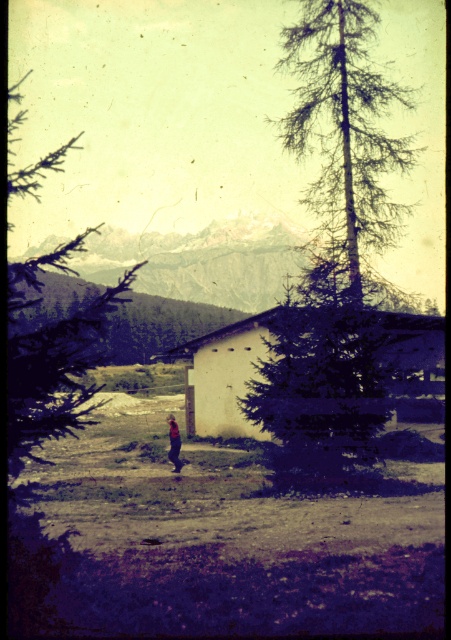
Question: Observing the image, what is the correct spatial positioning of white matte hut at center in reference to dark blue jeans at center?

Choices:
 (A) above
 (B) below

Answer: (A)

Question: Which object is farther from the camera taking this photo?

Choices:
 (A) green leafy tree at left
 (B) needle-like bark pine at center
 (C) white matte hut at center

Answer: (C)

Question: Among these points, which one is farthest from the camera?

Choices:
 (A) (174, 468)
 (B) (359, 349)

Answer: (A)

Question: Is green leafy tree at left thinner than dark blue jeans at center?

Choices:
 (A) yes
 (B) no

Answer: (B)

Question: Which point is farther to the camera?

Choices:
 (A) tap(27, 392)
 (B) tap(339, 332)

Answer: (B)

Question: Is the position of needle-like bark pine at center more distant than that of dark blue jeans at center?

Choices:
 (A) yes
 (B) no

Answer: (B)